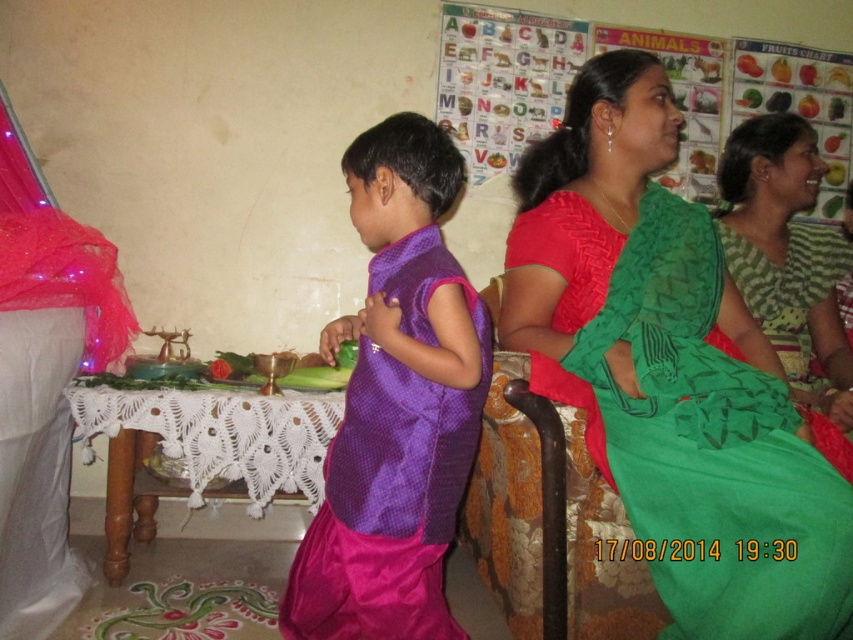
Question: Can you confirm if purple silk sari at center is wider than green woven sari at right?

Choices:
 (A) no
 (B) yes

Answer: (A)

Question: Which object appears closest to the camera in this image?

Choices:
 (A) purple silk sari at center
 (B) green silk saree at center

Answer: (B)

Question: Can you confirm if purple silk sari at center is positioned below white lace table at lower center?

Choices:
 (A) yes
 (B) no

Answer: (B)

Question: Which of the following is the farthest from the observer?

Choices:
 (A) green silk saree at center
 (B) white lace table at lower center
 (C) purple silk sari at center

Answer: (B)

Question: Does purple silk sari at center have a greater width compared to white lace table at lower center?

Choices:
 (A) no
 (B) yes

Answer: (A)

Question: Estimate the real-world distances between objects in this image. Which object is closer to the white lace table at lower center?

Choices:
 (A) green silk saree at center
 (B) purple silk sari at center
 (C) green woven sari at right

Answer: (B)